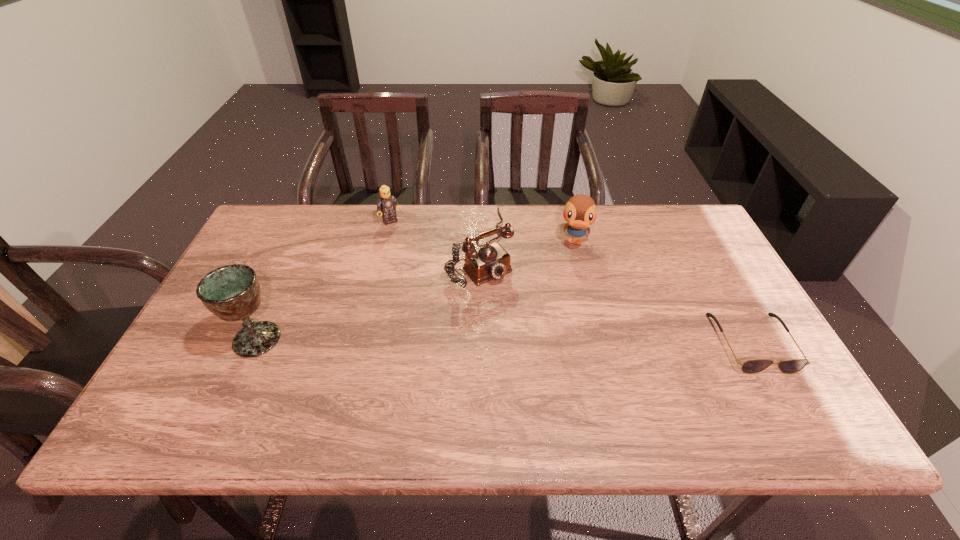
Choose which object is the second nearest neighbor to the chalice. Please provide its 2D coordinates. Your answer should be formatted as a tuple, i.e. [(x, y)], where the tuple contains the x and y coordinates of a point satisfying the conditions above.

[(386, 203)]

Identify the location of vacant space that satisfies the following two spatial constraints: 1. on the front side of the Lego; 2. on the right side of the duck. (386, 242).

The height and width of the screenshot is (540, 960). I want to click on vacant area that satisfies the following two spatial constraints: 1. on the back side of the leftmost object; 2. on the right side of the third object from left to right, so click(x=300, y=246).

Locate an element on the screen. Image resolution: width=960 pixels, height=540 pixels. vacant region that satisfies the following two spatial constraints: 1. on the back side of the tallest object; 2. on the right side of the fourth object from left to right is located at coordinates (301, 242).